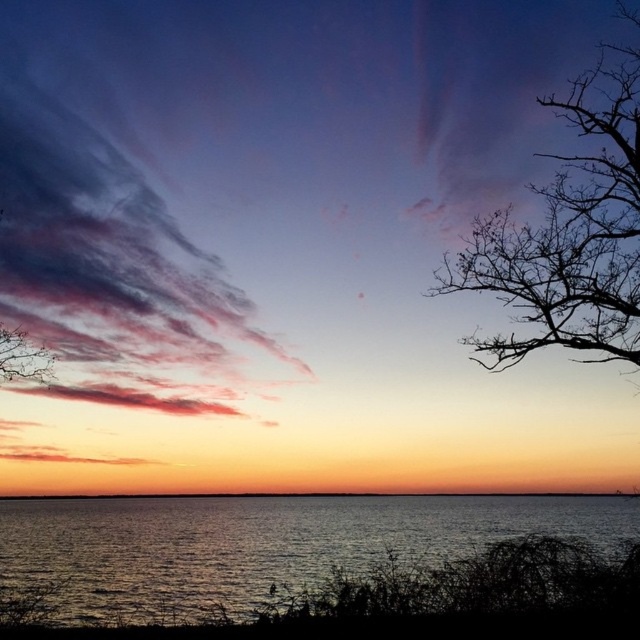
Question: Does pastel cotton clouds at upper left have a lesser width compared to smooth orange water at center?

Choices:
 (A) no
 (B) yes

Answer: (B)

Question: Which point is closer to the camera taking this photo?

Choices:
 (A) (3, 352)
 (B) (493, 211)
 (C) (54, 516)
 (D) (566, 496)

Answer: (A)

Question: Can you confirm if smooth orange water at center is wider than bare branches at upper left?

Choices:
 (A) yes
 (B) no

Answer: (A)

Question: Among these objects, which one is nearest to the camera?

Choices:
 (A) smooth orange water at center
 (B) black bare tree at upper right

Answer: (B)

Question: Can you confirm if smooth orange water at center is bigger than bare branches at upper left?

Choices:
 (A) yes
 (B) no

Answer: (A)

Question: Which point appears farthest from the camera in this image?

Choices:
 (A) (516, 227)
 (B) (4, 372)

Answer: (B)